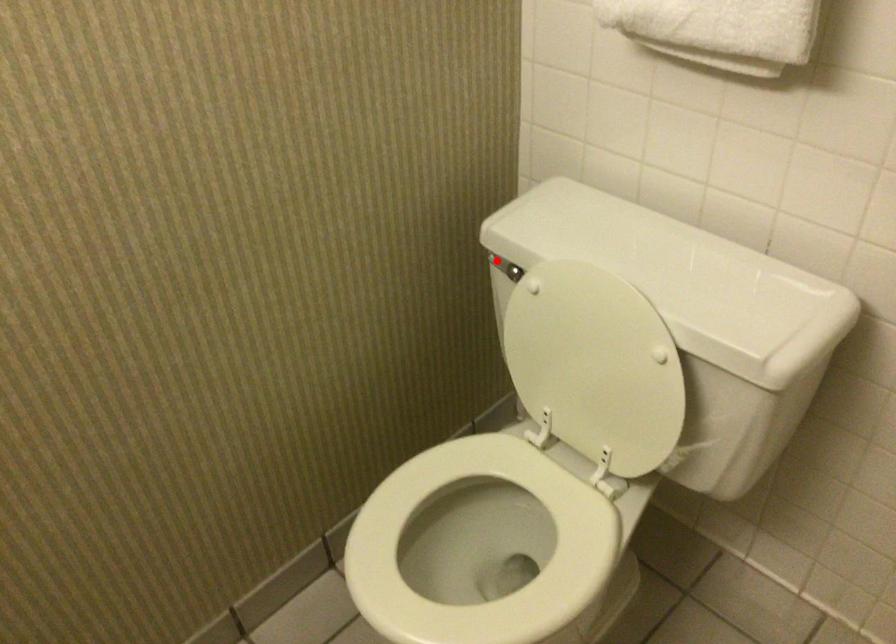
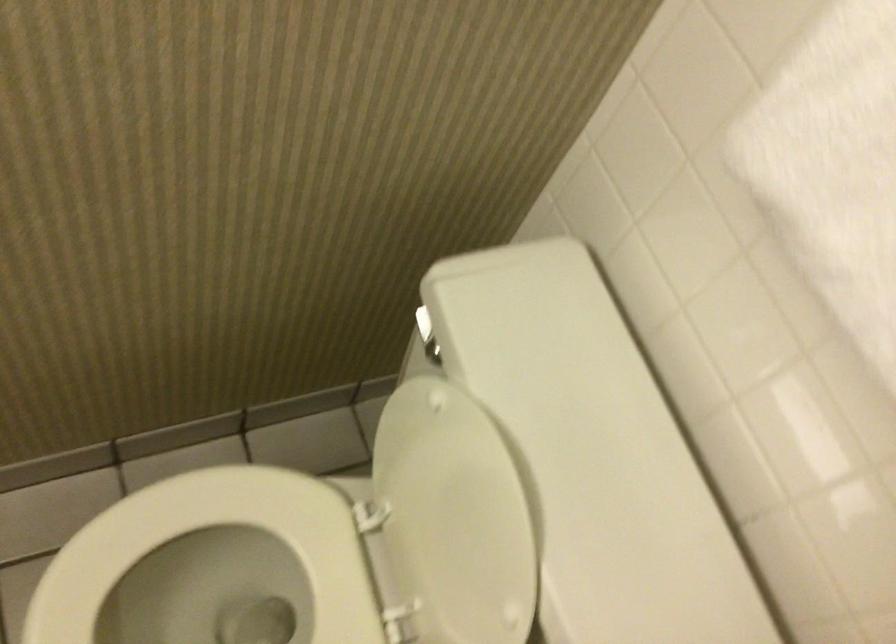
Question: I am providing you with two images of the same scene from different viewpoints. Given a red point in image1, look at the same physical point in image2. Is it:

Choices:
 (A) Closer to the viewpoint
 (B) Farther from the viewpoint

Answer: (A)